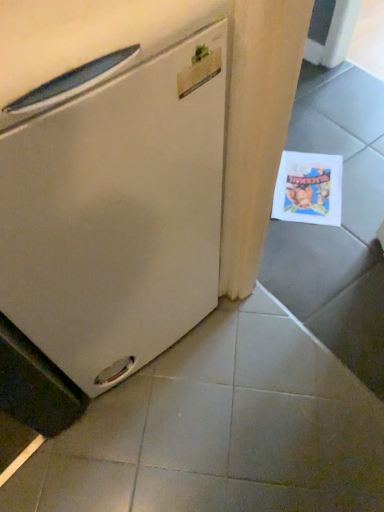
Question: Considering the relative sizes of gray matte tile at lower center and white matte refrigerator at left in the image provided, is gray matte tile at lower center thinner than white matte refrigerator at left?

Choices:
 (A) no
 (B) yes

Answer: (A)

Question: Is gray matte tile at lower center taller than white matte refrigerator at left?

Choices:
 (A) yes
 (B) no

Answer: (B)

Question: Is the surface of gray matte tile at lower center in direct contact with white matte refrigerator at left?

Choices:
 (A) yes
 (B) no

Answer: (B)

Question: Is gray matte tile at lower center far from white matte refrigerator at left?

Choices:
 (A) yes
 (B) no

Answer: (B)

Question: From a real-world perspective, is gray matte tile at lower center below white matte refrigerator at left?

Choices:
 (A) no
 (B) yes

Answer: (B)

Question: Is gray matte tile at lower center inside or outside of printed paper postcard at lower right?

Choices:
 (A) inside
 (B) outside

Answer: (B)

Question: Is gray matte tile at lower center wider or thinner than printed paper postcard at lower right?

Choices:
 (A) thin
 (B) wide

Answer: (B)

Question: Is point (248, 501) positioned closer to the camera than point (327, 164)?

Choices:
 (A) farther
 (B) closer

Answer: (B)

Question: Is gray matte tile at lower center taller or shorter than printed paper postcard at lower right?

Choices:
 (A) tall
 (B) short

Answer: (A)

Question: From the image's perspective, relative to gray matte tile at lower center, is printed paper postcard at lower right above or below?

Choices:
 (A) above
 (B) below

Answer: (A)

Question: In terms of size, does printed paper postcard at lower right appear bigger or smaller than gray matte tile at lower center?

Choices:
 (A) small
 (B) big

Answer: (A)

Question: Considering the positions of printed paper postcard at lower right and gray matte tile at lower center in the image, is printed paper postcard at lower right taller or shorter than gray matte tile at lower center?

Choices:
 (A) short
 (B) tall

Answer: (A)

Question: From a real-world perspective, relative to gray matte tile at lower center, is printed paper postcard at lower right vertically above or below?

Choices:
 (A) below
 (B) above

Answer: (B)

Question: Considering the positions of gray matte tile at lower center and white matte refrigerator at left in the image, is gray matte tile at lower center bigger or smaller than white matte refrigerator at left?

Choices:
 (A) small
 (B) big

Answer: (A)

Question: From a real-world perspective, is gray matte tile at lower center physically located above or below white matte refrigerator at left?

Choices:
 (A) above
 (B) below

Answer: (B)